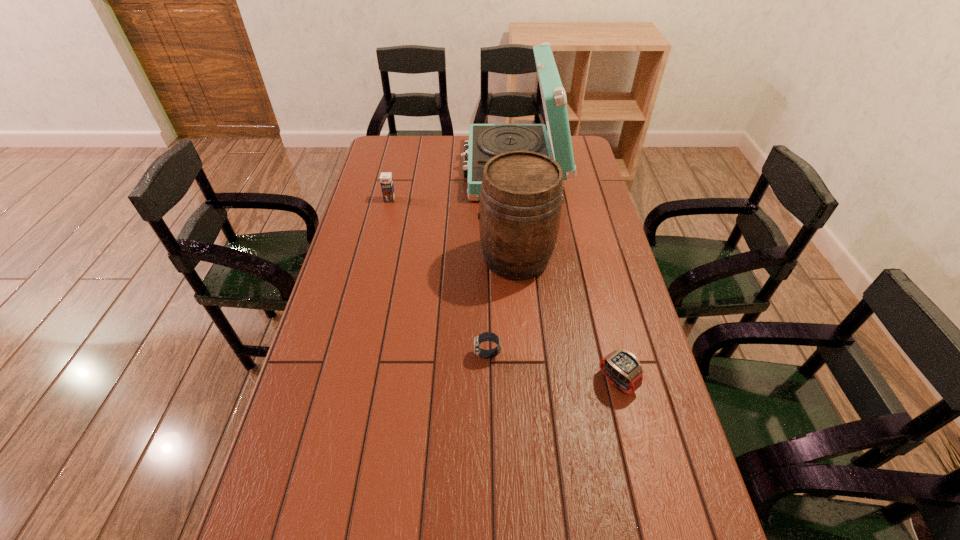
This screenshot has height=540, width=960. Find the location of `empty location between the cider and the leftmost object`. empty location between the cider and the leftmost object is located at coordinates (453, 229).

Identify the location of free space that is in between the leftmost object and the right watch. (503, 291).

Identify the location of free space that is in between the third tallest object and the farther watch. This screenshot has height=540, width=960. (439, 278).

You are a GUI agent. You are given a task and a screenshot of the screen. Output one action in this format:
    pyautogui.click(x=<x>, y=<y>)
    Task: Click on the object that is the second closest to the fourth farthest object
    This screenshot has height=540, width=960.
    Given the screenshot: What is the action you would take?
    pyautogui.click(x=621, y=367)

Where is `object that is the third nearest to the right watch`? The height and width of the screenshot is (540, 960). object that is the third nearest to the right watch is located at coordinates (486, 141).

Choose which watch is the nearest neighbor to the tallest object. Please provide its 2D coordinates. Your answer should be formatted as a tuple, i.e. [(x, y)], where the tuple contains the x and y coordinates of a point satisfying the conditions above.

[(486, 336)]

You are a GUI agent. You are given a task and a screenshot of the screen. Output one action in this format:
    pyautogui.click(x=<x>, y=<y>)
    Task: Click on the watch identified as the second closest to the fourth shortest object
    Image resolution: width=960 pixels, height=540 pixels.
    Given the screenshot: What is the action you would take?
    pyautogui.click(x=621, y=367)

Image resolution: width=960 pixels, height=540 pixels. I want to click on vacant space that satisfies the following two spatial constraints: 1. on the face of the left watch; 2. on the right side of the nearer watch, so click(x=488, y=381).